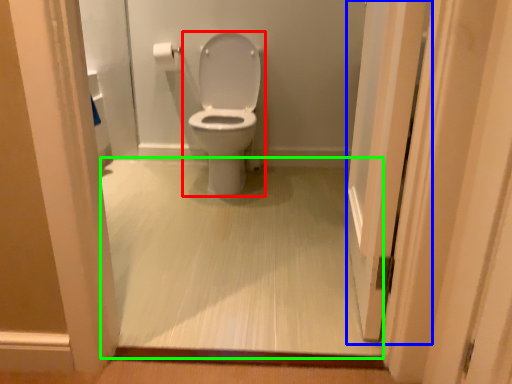
Question: Which is farther away from toilet (highlighted by a red box)? screen door (highlighted by a blue box) or corridor (highlighted by a green box)?

Choices:
 (A) screen door
 (B) corridor

Answer: (A)